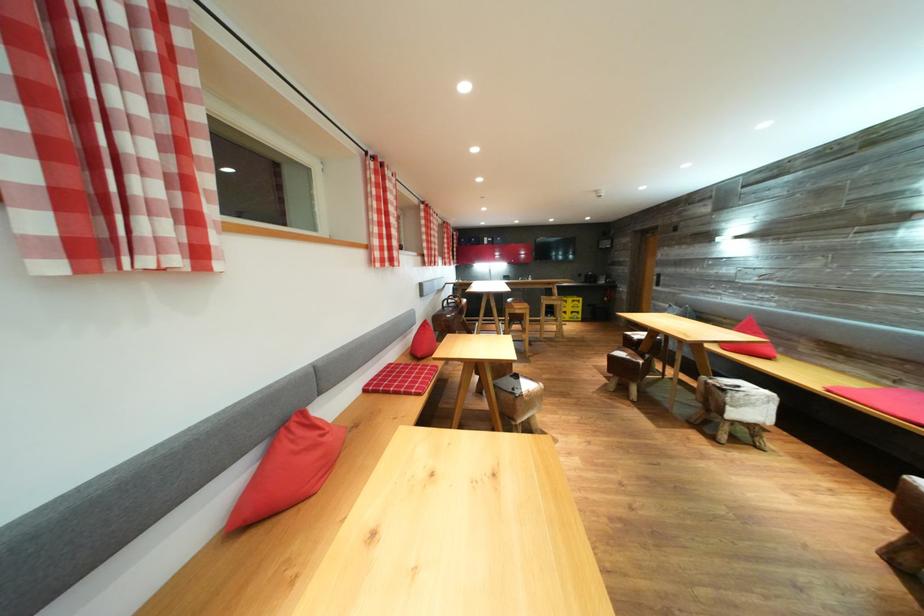
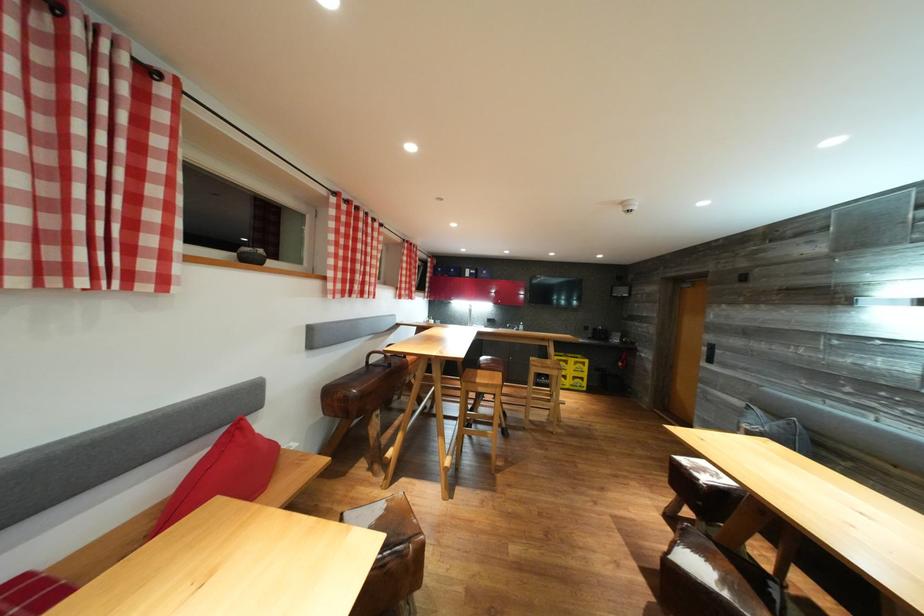
Find the pixel in the second image that matches (x=394, y=270) in the first image.

(23, 286)